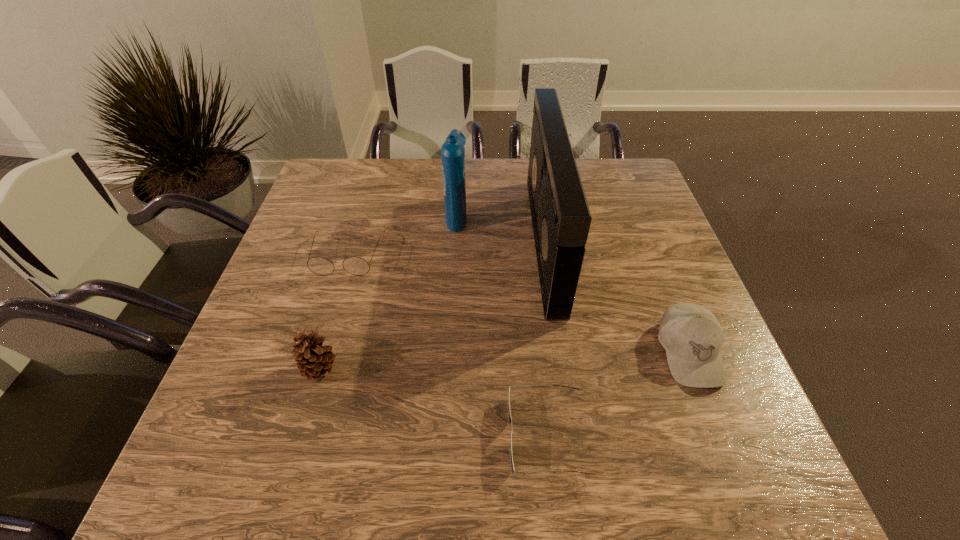
Where is `the fifth closest object to the videotape`? Image resolution: width=960 pixels, height=540 pixels. the fifth closest object to the videotape is located at coordinates (314, 360).

I want to click on vacant space that satisfies the following two spatial constraints: 1. on the front-facing side of the fourth tallest object; 2. on the front-facing side of the sunglasses, so click(721, 436).